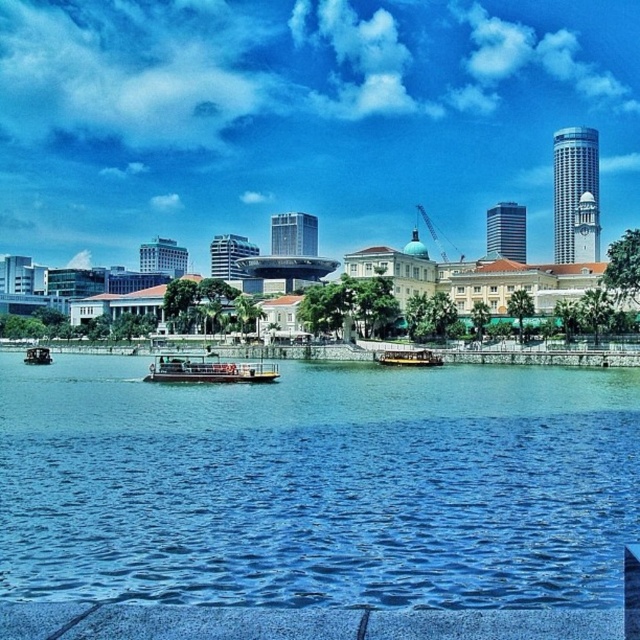
Question: Which of the following is the closest to the observer?

Choices:
 (A) (49, 353)
 (B) (381, 362)
 (C) (51, 483)
 (D) (243, 381)

Answer: (C)

Question: Which of the following is the farthest from the observer?

Choices:
 (A) yellow matte boat at center
 (B) wooden boat at center

Answer: (B)

Question: Is yellow matte boat at center wider than wooden boat at center?

Choices:
 (A) yes
 (B) no

Answer: (A)

Question: Does blue water at center appear under wooden boat at center?

Choices:
 (A) no
 (B) yes

Answer: (B)

Question: Which of the following is the closest to the observer?

Choices:
 (A) wooden polished boat at center
 (B) blue water at center

Answer: (B)

Question: From the image, what is the correct spatial relationship of blue water at center in relation to yellow matte boat at center?

Choices:
 (A) above
 (B) below

Answer: (B)